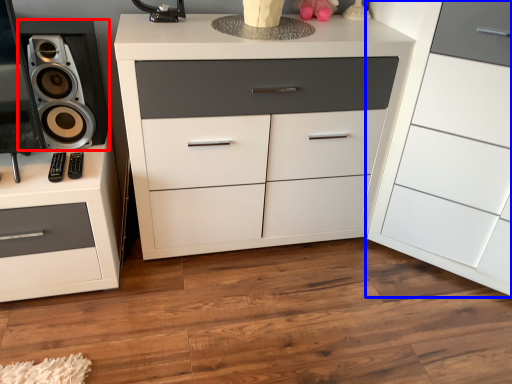
Question: Which object is further to the camera taking this photo, speaker (highlighted by a red box) or chest of drawers (highlighted by a blue box)?

Choices:
 (A) speaker
 (B) chest of drawers

Answer: (A)